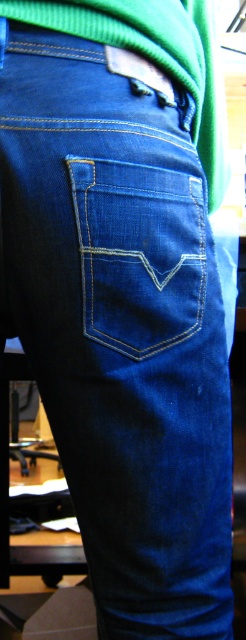
Based on the photo, between denim blue jeans pocket at center and green cotton sweater at upper center, which one has less height?

denim blue jeans pocket at center is shorter.

Who is positioned more to the right, denim blue jeans pocket at center or green cotton sweater at upper center?

From the viewer's perspective, green cotton sweater at upper center appears more on the right side.

Which is behind, point (113, 232) or point (100, 28)?

Positioned behind is point (100, 28).

Find the location of a particular element. denim blue jeans pocket at center is located at coordinates (139, 252).